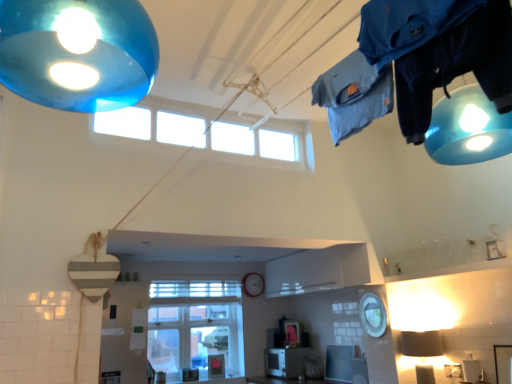
Question: Is transparent glass window at upper center, placed as the first window when sorted from top to bottom, outside of metallic silver clock at center?

Choices:
 (A) yes
 (B) no

Answer: (A)

Question: Is transparent glass window at upper center, acting as the second window starting from the bottom, bigger than metallic silver clock at center?

Choices:
 (A) no
 (B) yes

Answer: (B)

Question: Can you confirm if transparent glass window at upper center, marked as the 1th window in a front-to-back arrangement, is wider than metallic silver clock at center?

Choices:
 (A) yes
 (B) no

Answer: (A)

Question: From a real-world perspective, does transparent glass window at upper center, placed as the first window when sorted from top to bottom, sit lower than metallic silver clock at center?

Choices:
 (A) yes
 (B) no

Answer: (B)

Question: From the image's perspective, would you say transparent glass window at upper center, marked as the 1th window in a front-to-back arrangement, is shown under metallic silver clock at center?

Choices:
 (A) no
 (B) yes

Answer: (A)

Question: Is transparent glass window at upper center, placed as the first window when sorted from top to bottom, facing away from metallic silver clock at center?

Choices:
 (A) yes
 (B) no

Answer: (B)

Question: Is the depth of satin silver toaster at center greater than that of transparent glass window at upper center, which ranks as the second window in back-to-front order?

Choices:
 (A) no
 (B) yes

Answer: (B)

Question: Is satin silver toaster at center located outside transparent glass window at upper center, placed as the first window when sorted from top to bottom?

Choices:
 (A) yes
 (B) no

Answer: (A)

Question: Is satin silver toaster at center thinner than transparent glass window at upper center, acting as the second window starting from the bottom?

Choices:
 (A) yes
 (B) no

Answer: (B)

Question: From the image's perspective, is satin silver toaster at center over transparent glass window at upper center, which ranks as the second window in back-to-front order?

Choices:
 (A) yes
 (B) no

Answer: (B)

Question: Does satin silver toaster at center appear on the left side of transparent glass window at upper center, marked as the 1th window in a front-to-back arrangement?

Choices:
 (A) no
 (B) yes

Answer: (A)

Question: Is satin silver toaster at center aimed at transparent glass window at upper center, which ranks as the second window in back-to-front order?

Choices:
 (A) yes
 (B) no

Answer: (B)

Question: Is clear glass window at center, the first window in the back-to-front sequence, directly adjacent to transparent glass window at upper center, placed as the first window when sorted from top to bottom?

Choices:
 (A) no
 (B) yes

Answer: (A)